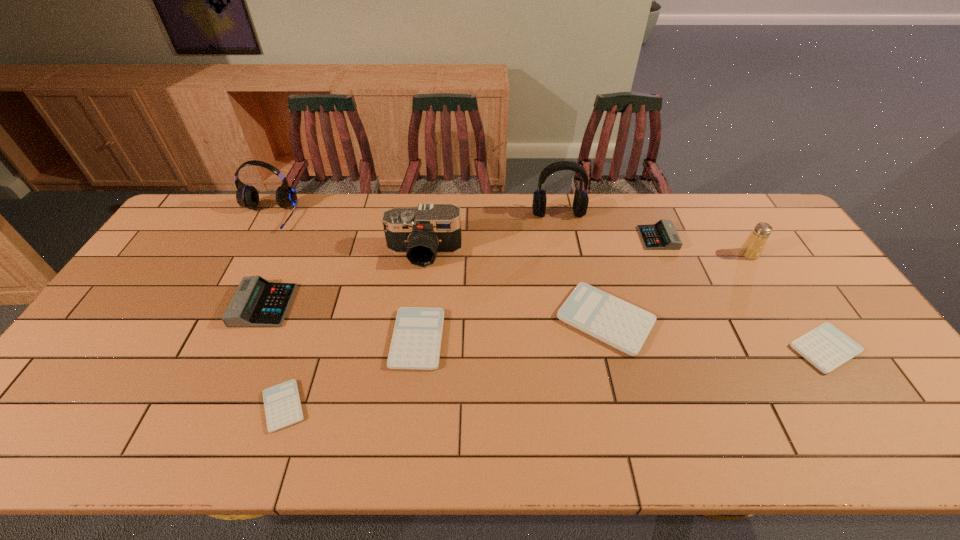
Find the location of a particular element. The image size is (960, 540). the fourth calculator from left to right is located at coordinates (624, 326).

Locate an element on the screen. This screenshot has height=540, width=960. the eighth tallest object is located at coordinates (416, 341).

Locate an element on the screen. the fourth calculator from right to left is located at coordinates (416, 341).

This screenshot has height=540, width=960. Identify the location of the rightmost calculator. (826, 347).

Identify the location of the ninth tallest object. This screenshot has height=540, width=960. (826, 347).

Where is `the shortest object`? the shortest object is located at coordinates (282, 404).

You are a GUI agent. You are given a task and a screenshot of the screen. Output one action in this format:
    pyautogui.click(x=<x>, y=<y>)
    Task: Click on the smallest white calculator
    
    Given the screenshot: What is the action you would take?
    pyautogui.click(x=282, y=404)

At what (x,y) coordinates should I click in order to perform the action: click on free space located on the headband of the right headset. Please return your answer as a coordinate pair (x, y). The image size is (960, 540). Looking at the image, I should click on (572, 282).

Where is `free space located 0.070m on the ear cushions of the left headset`? The width and height of the screenshot is (960, 540). free space located 0.070m on the ear cushions of the left headset is located at coordinates (251, 248).

Image resolution: width=960 pixels, height=540 pixels. Find the location of `vacant space located on the front-facing side of the black camera`. vacant space located on the front-facing side of the black camera is located at coordinates (417, 312).